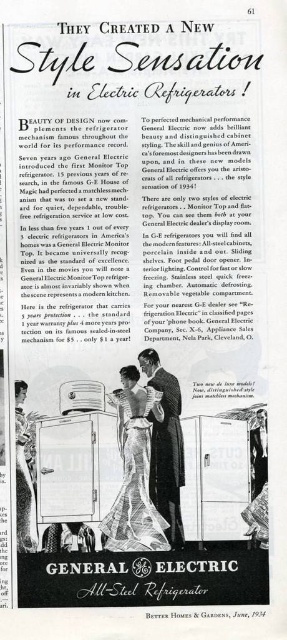
You are a delivery person who needs to bring both the metallic silver trolley at center and the silky black suit at center through a narrow doorway. Based on their widths, which item should you carry first?

The metallic silver trolley at center might be wider than the silky black suit at center, so you should carry the metallic silver trolley at center first to ensure it fits through the doorway.

You are standing in front of the vintage advertisement. Which of the two points, point (105,412) or point (177,509), is closer to you?

Point (105,412) is closer to you because it is further to the viewer than point (177,509).

In the scene shown: In the vintage General Electric refrigerator advertisement from 1934, there is a metallic silver trolley at center and a silky black suit at center. How far apart are these two items?

The metallic silver trolley at center is 4.26 inches away from the silky black suit at center.